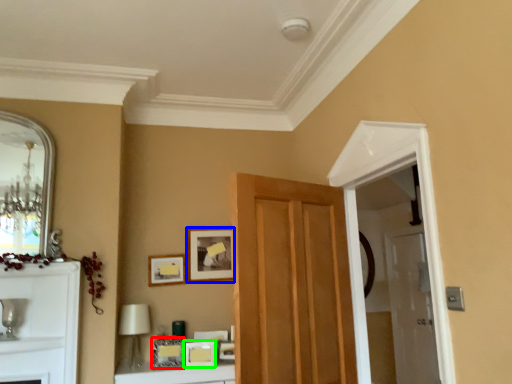
Question: Which object is positioned farthest from picture frame (highlighted by a red box)? Select from picture frame (highlighted by a blue box) and picture frame (highlighted by a green box).

Choices:
 (A) picture frame
 (B) picture frame

Answer: (A)